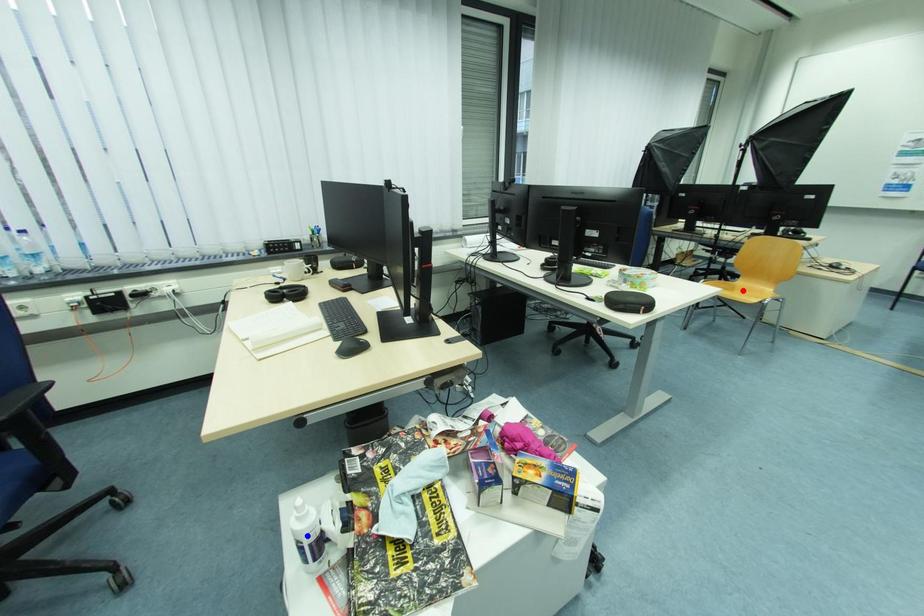
Question: Which of the two points in the image is closer to the camera?

Choices:
 (A) Blue point is closer.
 (B) Red point is closer.

Answer: (A)